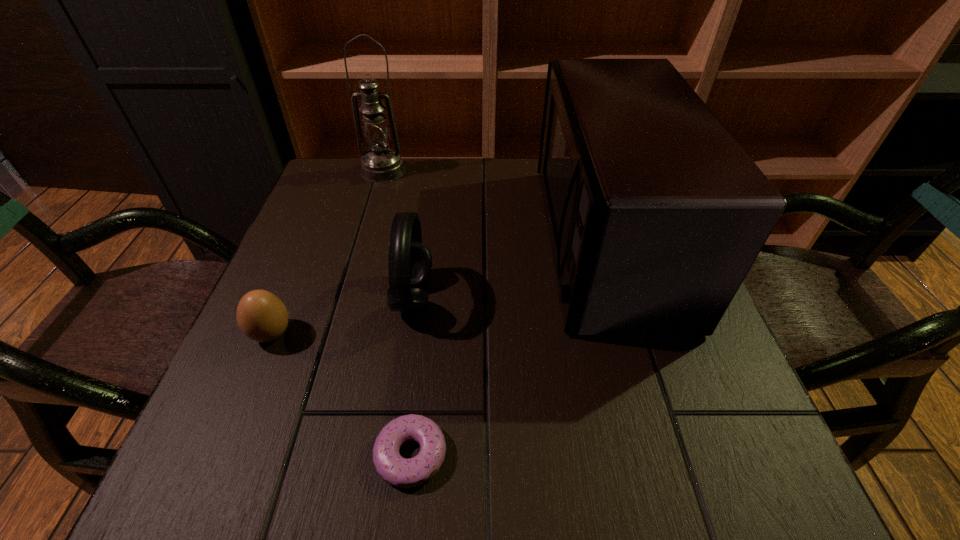
In order to click on vacant space that satisfies the following two spatial constraints: 1. on the earcups of the third tallest object; 2. on the left side of the doughnut in this screenshot , I will do `click(391, 454)`.

I want to click on free point that satisfies the following two spatial constraints: 1. on the earcups of the shortest object; 2. on the right side of the headset, so click(x=391, y=454).

This screenshot has width=960, height=540. Find the location of `free point that satisfies the following two spatial constraints: 1. on the earcups of the headset; 2. on the right side of the shortest object`. free point that satisfies the following two spatial constraints: 1. on the earcups of the headset; 2. on the right side of the shortest object is located at coordinates [x=391, y=454].